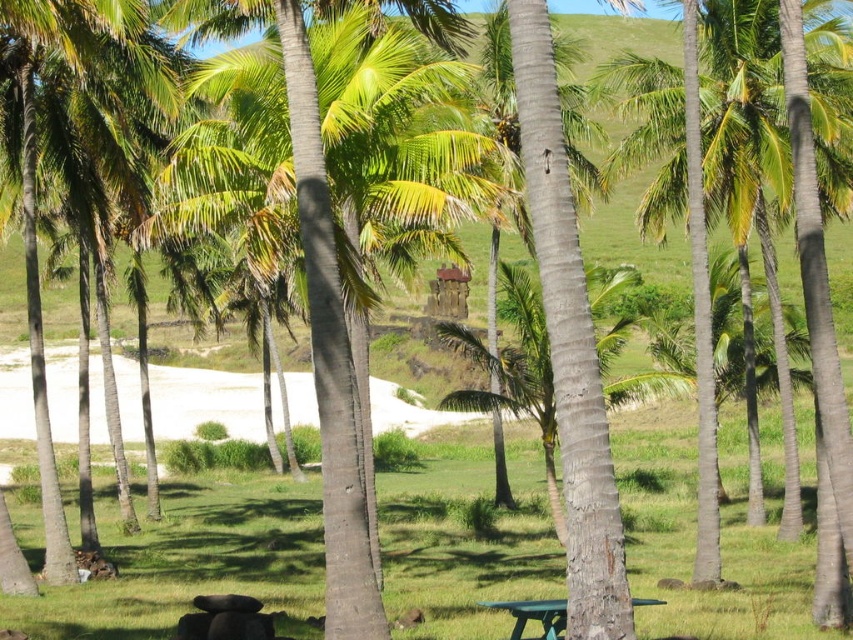
Consider the image. You are standing at the point closest to the palm trees in this tropical scene. There are two points marked in the image, point A at coordinates point [312,189] and point B at coordinates point [524,602]. Which point is closer to you?

Point A at coordinates point [312,189] is closer to you because it is in front of point B at coordinates point [524,602].

You are planning to set up a picnic area in this tropical setting. You have a large blanket that is 2 meters wide. Considering the space between the green leafy palm tree at center and the green plastic picnic table at lower center, will the blanket fit comfortably without overlapping either object?

The green leafy palm tree at center is wider than the green plastic picnic table at lower center. Since the palm tree is wider, the space between them might be sufficient for a 2m blanket, but exact placement depends on their positioning. However, based on width comparison alone, the blanket could potentially fit if positioned correctly between the two objects.

You are standing at the point with coordinates 0.5, 0.5 in this tropical scene. You want to walk towards the green leafy palm tree at center. Which direction should you move in?

The green leafy palm tree at center is located at point (312, 308). Since your current position is at (426, 320), you should move slightly to the left and upwards to reach it.